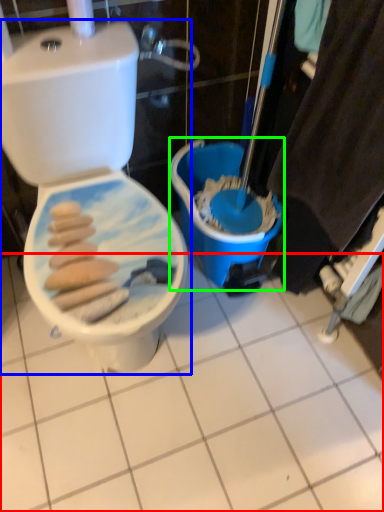
Question: Which object is the farthest from ceramic tile (highlighted by a red box)? Choose among these: toilet (highlighted by a blue box) or potty (highlighted by a green box).

Choices:
 (A) toilet
 (B) potty

Answer: (A)